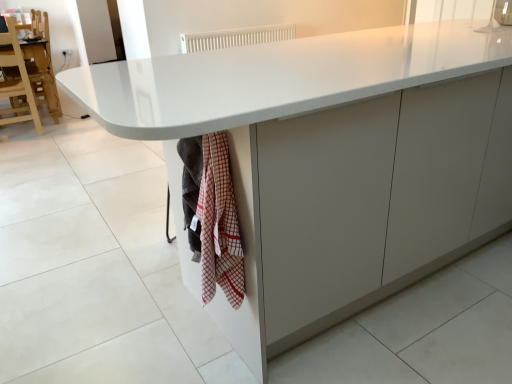
Question: From the image's perspective, is wooden chair at left under white glossy granite at lower left?

Choices:
 (A) yes
 (B) no

Answer: (B)

Question: From a real-world perspective, is wooden chair at left positioned over white glossy granite at lower left based on gravity?

Choices:
 (A) yes
 (B) no

Answer: (A)

Question: Is wooden chair at left outside of white glossy granite at lower left?

Choices:
 (A) no
 (B) yes

Answer: (B)

Question: Is wooden chair at left at the right side of white glossy granite at lower left?

Choices:
 (A) yes
 (B) no

Answer: (B)

Question: Is the surface of wooden chair at left in direct contact with white glossy granite at lower left?

Choices:
 (A) yes
 (B) no

Answer: (B)

Question: Would you say wooden chair at left is to the left or to the right of white glossy granite at lower left in the picture?

Choices:
 (A) right
 (B) left

Answer: (B)

Question: Is wooden chair at left situated inside white glossy granite at lower left or outside?

Choices:
 (A) inside
 (B) outside

Answer: (B)

Question: Is wooden chair at left taller or shorter than white glossy granite at lower left?

Choices:
 (A) short
 (B) tall

Answer: (B)

Question: Considering the positions of point (16, 96) and point (0, 349), is point (16, 96) closer or farther from the camera than point (0, 349)?

Choices:
 (A) closer
 (B) farther

Answer: (B)

Question: Visually, is white glossy granite at lower left positioned to the left or to the right of red checkered towel at lower center?

Choices:
 (A) right
 (B) left

Answer: (B)

Question: Is white glossy granite at lower left wider or thinner than red checkered towel at lower center?

Choices:
 (A) wide
 (B) thin

Answer: (A)

Question: From the image's perspective, is white glossy granite at lower left positioned above or below red checkered towel at lower center?

Choices:
 (A) below
 (B) above

Answer: (A)

Question: Is white glossy granite at lower left taller or shorter than red checkered towel at lower center?

Choices:
 (A) short
 (B) tall

Answer: (A)

Question: From the image's perspective, relative to white plastic radiator at upper center, is red checkered towel at lower center above or below?

Choices:
 (A) above
 (B) below

Answer: (B)

Question: Would you say red checkered towel at lower center is to the left or to the right of white plastic radiator at upper center in the picture?

Choices:
 (A) right
 (B) left

Answer: (B)